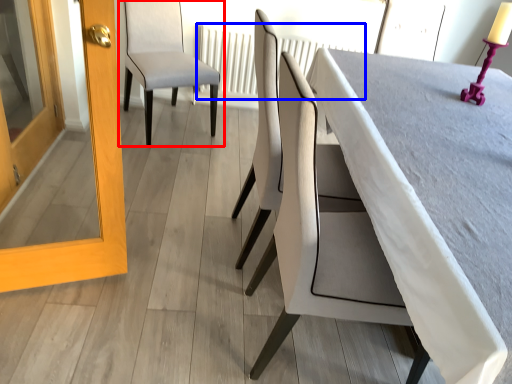
Question: Among these objects, which one is farthest to the camera, chair (highlighted by a red box) or radiator (highlighted by a blue box)?

Choices:
 (A) chair
 (B) radiator

Answer: (B)